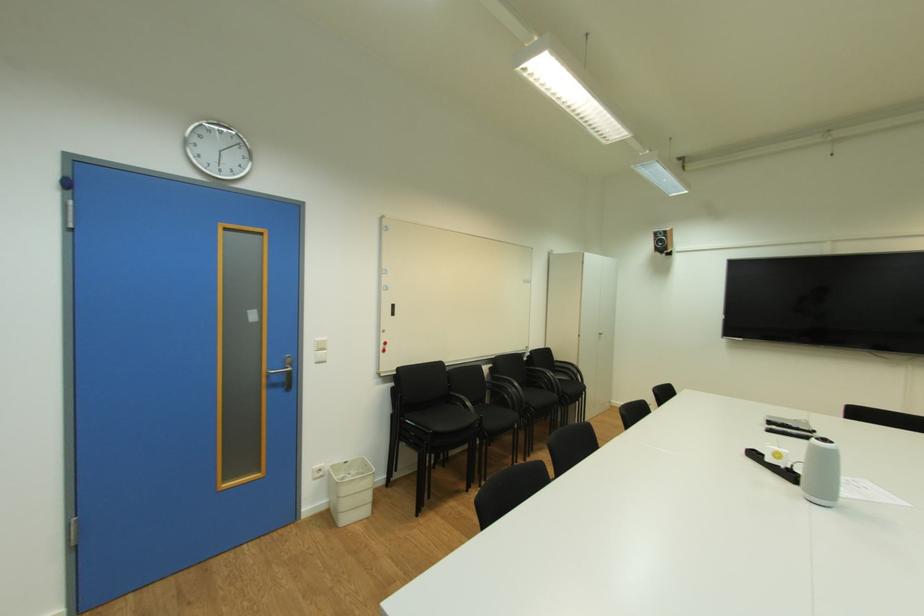
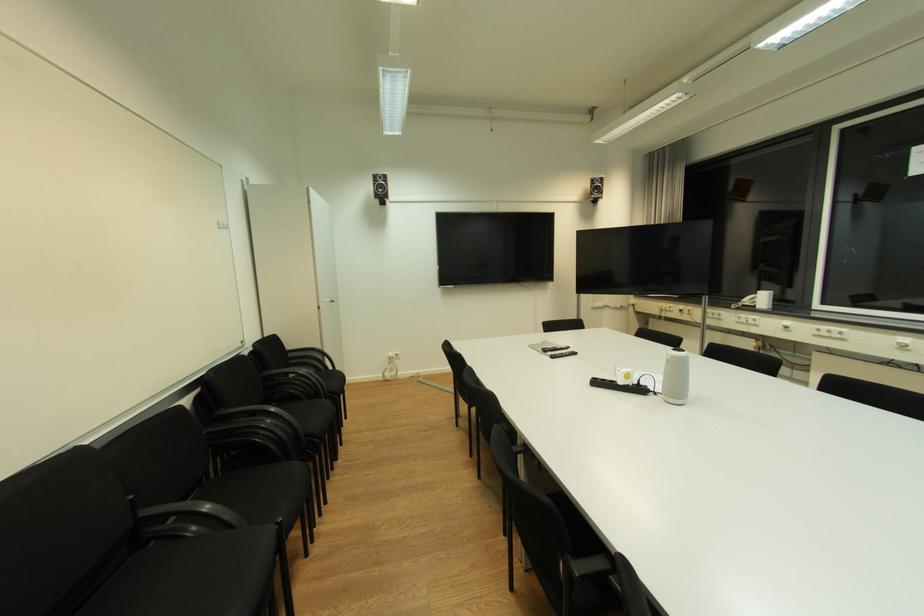
Where in the second image is the point corresponding to [455,386] from the first image?

(137, 498)